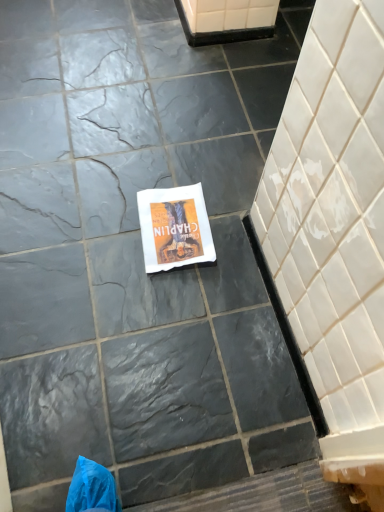
Where is `white paper towel at center`? This screenshot has height=512, width=384. white paper towel at center is located at coordinates (174, 228).

Measure the distance between point (188, 244) and camera.

1.27 meters.

From the picture: What is the approximate height of white paper towel at center?

white paper towel at center is 0.52 inches in height.

The height and width of the screenshot is (512, 384). What do you see at coordinates (174, 228) in the screenshot? I see `white paper towel at center` at bounding box center [174, 228].

At what (x,y) coordinates should I click in order to perform the action: click on white paper towel at center. Please return your answer as a coordinate pair (x, y). Looking at the image, I should click on (174, 228).